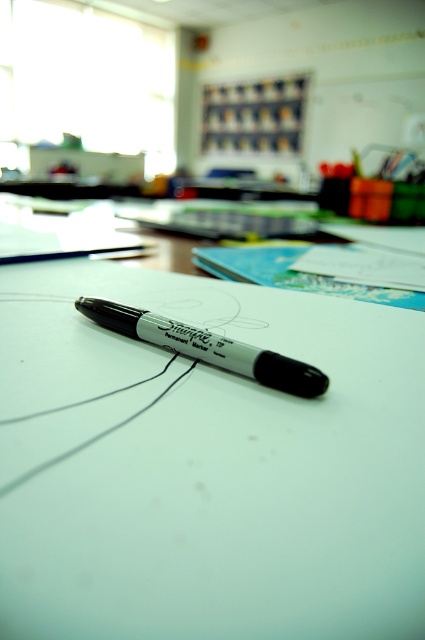
You are organizing a classroom and need to place a new bulletin board. You see the point at coordinates point (206, 467) where white paper at center is located. Where should you place the bulletin board relative to the white paper at center?

The white paper at center is located at point (206, 467), so you should place the bulletin board away from that point to avoid overlapping with the existing white paper at center.

You need to write a note using the black marker pen at center. Based on the scene, can you determine if the white paper at center is wide enough to fit the marker?

The white paper at center might be wider than black marker pen at center, so it is possible that the white paper at center can accommodate the black marker pen at center, but there is uncertainty due to the description using the word might.

You need to write a note using the black marker pen at center. Since the white paper at center is the only available surface, will the paper be big enough to accommodate the marker?

The white paper at center is larger in size than black marker pen at center, so yes, the paper will be big enough to accommodate the marker.